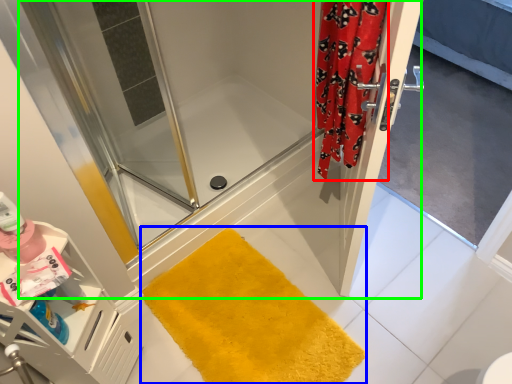
Question: Considering the real-world distances, which object is farthest from shower curtain (highlighted by a red box)? bath mat (highlighted by a blue box) or shower door (highlighted by a green box)?

Choices:
 (A) bath mat
 (B) shower door

Answer: (A)